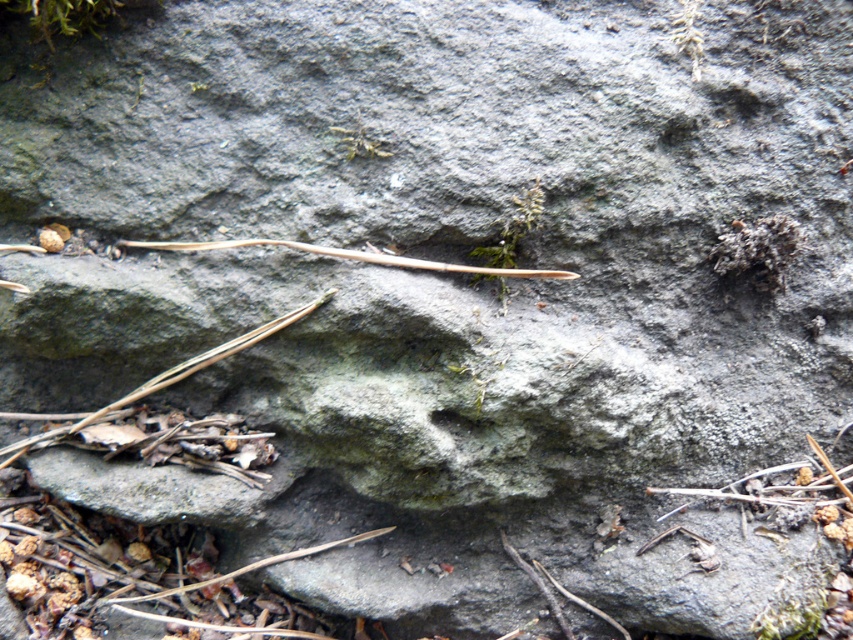
Is brown wood twig at center behind brown/dry wood twig at lower left?

No, brown wood twig at center is in front of brown/dry wood twig at lower left.

Where is `brown wood twig at center`? This screenshot has width=853, height=640. brown wood twig at center is located at coordinates (351, 257).

I want to click on brown wood twig at center, so 351,257.